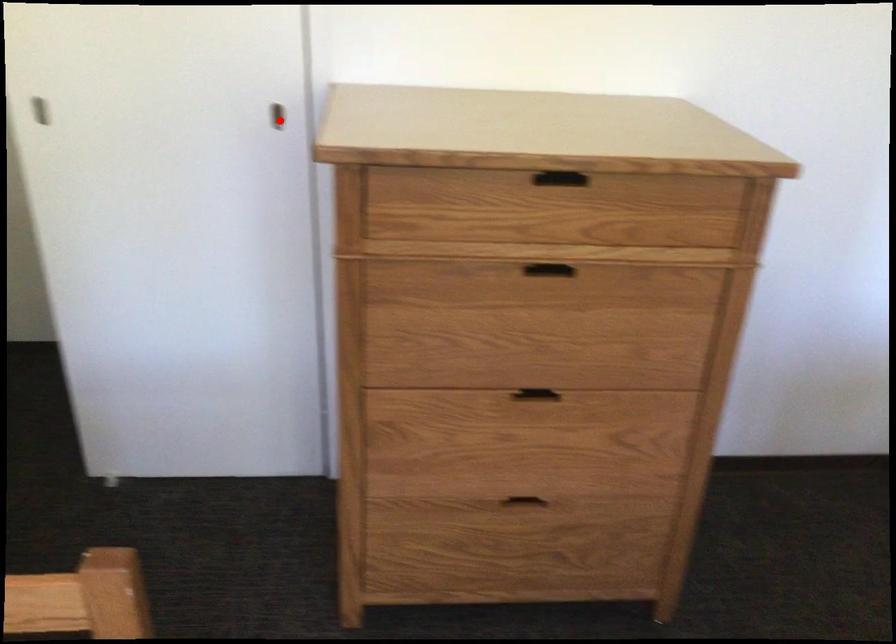
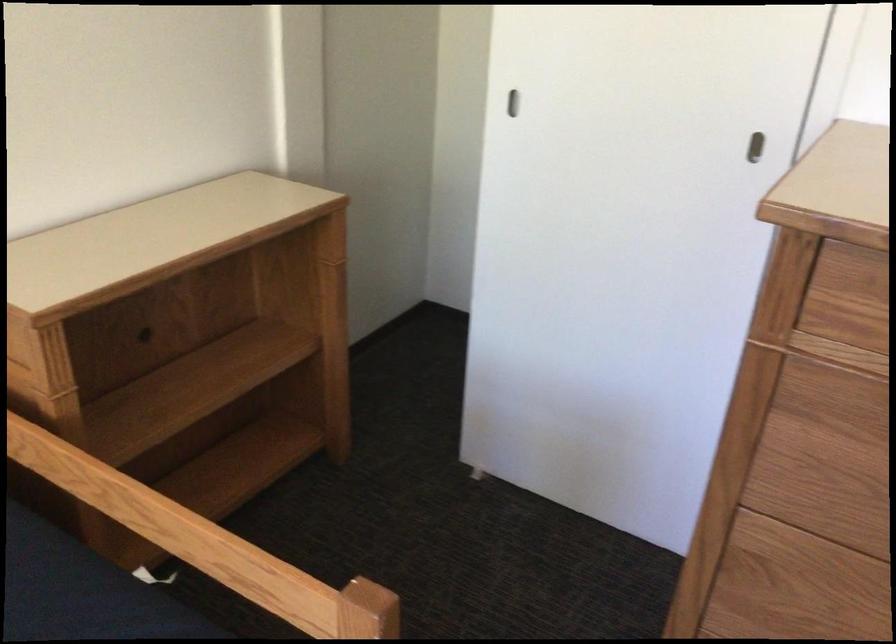
Question: I am providing you with two images of the same scene from different viewpoints. A red point is shown in image1. For the corresponding object point in image2, is it positioned nearer or farther from the camera?

Choices:
 (A) Nearer
 (B) Farther

Answer: (A)